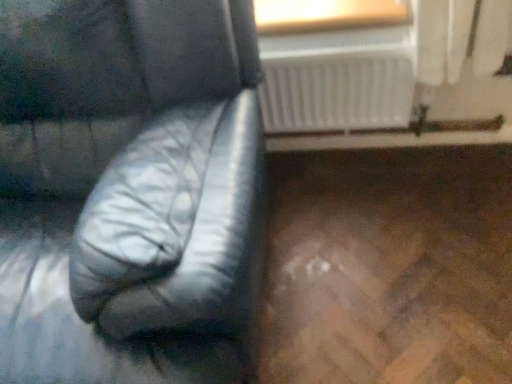
Question: Is wooden frame at upper center next to white plastic radiator at upper center and touching it?

Choices:
 (A) yes
 (B) no

Answer: (B)

Question: From a real-world perspective, is wooden frame at upper center positioned over white plastic radiator at upper center based on gravity?

Choices:
 (A) no
 (B) yes

Answer: (B)

Question: Considering the relative sizes of wooden frame at upper center and white plastic radiator at upper center in the image provided, is wooden frame at upper center taller than white plastic radiator at upper center?

Choices:
 (A) yes
 (B) no

Answer: (B)

Question: Is wooden frame at upper center at the right side of white plastic radiator at upper center?

Choices:
 (A) no
 (B) yes

Answer: (A)

Question: From the image's perspective, is wooden frame at upper center located above white plastic radiator at upper center?

Choices:
 (A) yes
 (B) no

Answer: (A)

Question: From the image's perspective, is black leather armchair at left located above or below wooden frame at upper center?

Choices:
 (A) below
 (B) above

Answer: (A)

Question: From a real-world perspective, is black leather armchair at left above or below wooden frame at upper center?

Choices:
 (A) above
 (B) below

Answer: (B)

Question: Is point (115, 213) positioned closer to the camera than point (302, 1)?

Choices:
 (A) farther
 (B) closer

Answer: (B)

Question: Considering their positions, is black leather armchair at left located in front of or behind wooden frame at upper center?

Choices:
 (A) front
 (B) behind

Answer: (A)

Question: In terms of size, does white plastic radiator at upper center appear bigger or smaller than black leather armchair at left?

Choices:
 (A) big
 (B) small

Answer: (B)

Question: Does point (404, 122) appear closer or farther from the camera than point (42, 289)?

Choices:
 (A) farther
 (B) closer

Answer: (A)

Question: Choose the correct answer: Is white plastic radiator at upper center inside black leather armchair at left or outside it?

Choices:
 (A) inside
 (B) outside

Answer: (B)

Question: Is white plastic radiator at upper center taller or shorter than black leather armchair at left?

Choices:
 (A) tall
 (B) short

Answer: (B)

Question: Would you say wooden frame at upper center is to the left or to the right of black leather armchair at left in the picture?

Choices:
 (A) right
 (B) left

Answer: (A)

Question: Considering the positions of wooden frame at upper center and black leather armchair at left in the image, is wooden frame at upper center taller or shorter than black leather armchair at left?

Choices:
 (A) tall
 (B) short

Answer: (B)